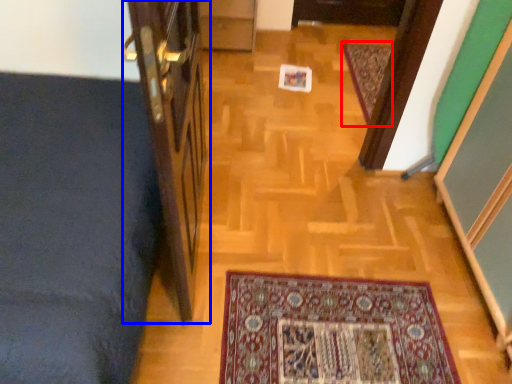
Question: Which object is further to the camera taking this photo, mat (highlighted by a red box) or door (highlighted by a blue box)?

Choices:
 (A) mat
 (B) door

Answer: (A)